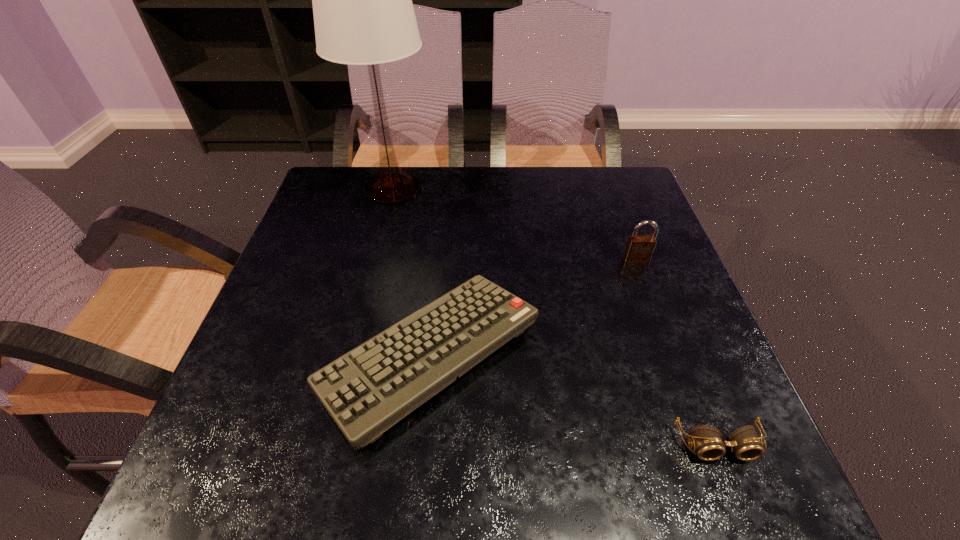
This screenshot has height=540, width=960. In order to click on the farthest object in this screenshot , I will do `click(363, 13)`.

Locate an element on the screen. This screenshot has width=960, height=540. the tallest object is located at coordinates (363, 13).

Where is `the second farthest object`? Image resolution: width=960 pixels, height=540 pixels. the second farthest object is located at coordinates (639, 249).

The height and width of the screenshot is (540, 960). Identify the location of padlock. (639, 249).

The image size is (960, 540). Find the location of `computer keyboard`. computer keyboard is located at coordinates (366, 391).

The height and width of the screenshot is (540, 960). What are the coordinates of `goggles` in the screenshot? It's located at [744, 442].

Identify the location of free space located 0.160m above the cylindrical shade of the farthest object. The height and width of the screenshot is (540, 960). (376, 254).

Locate an element on the screen. The width and height of the screenshot is (960, 540). free space located 0.120m on the front-facing side of the second farthest object is located at coordinates (652, 303).

The image size is (960, 540). Find the location of `vacant space located on the back of the computer keyboard`. vacant space located on the back of the computer keyboard is located at coordinates (445, 188).

Identify the location of object at the far edge. (363, 13).